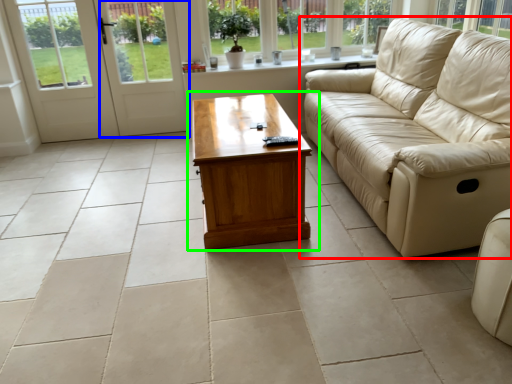
Question: Which is nearer to the studio couch (highlighted by a red box)? screen door (highlighted by a blue box) or coffee table (highlighted by a green box).

Choices:
 (A) screen door
 (B) coffee table

Answer: (B)